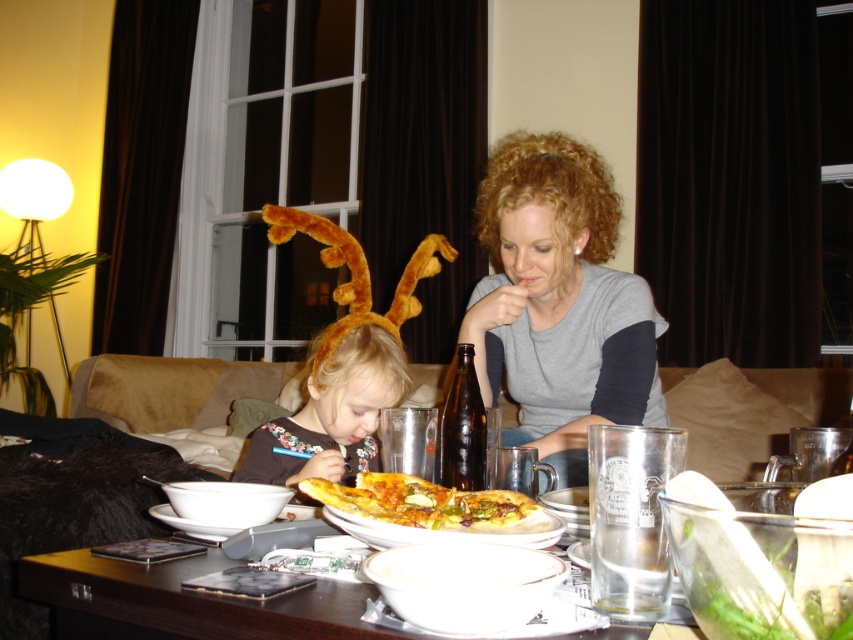
Question: Among these points, which one is farthest from the camera?

Choices:
 (A) (158, 506)
 (B) (318, 381)

Answer: (B)

Question: Among these points, which one is farthest from the camera?

Choices:
 (A) (306, 509)
 (B) (259, 467)
 (C) (47, 577)
 (D) (479, 445)

Answer: (B)

Question: Can you confirm if golden crispy pizza at center is positioned below golden crusty pizza at center?

Choices:
 (A) no
 (B) yes

Answer: (A)

Question: Which of the following is the farthest from the observer?

Choices:
 (A) matte brown hair at center
 (B) wooden table at center

Answer: (A)

Question: Is brown furry bunny ears at center below matte brown hair at center?

Choices:
 (A) yes
 (B) no

Answer: (B)

Question: Does brown furry bunny ears at center have a larger size compared to matte brown hair at center?

Choices:
 (A) no
 (B) yes

Answer: (B)